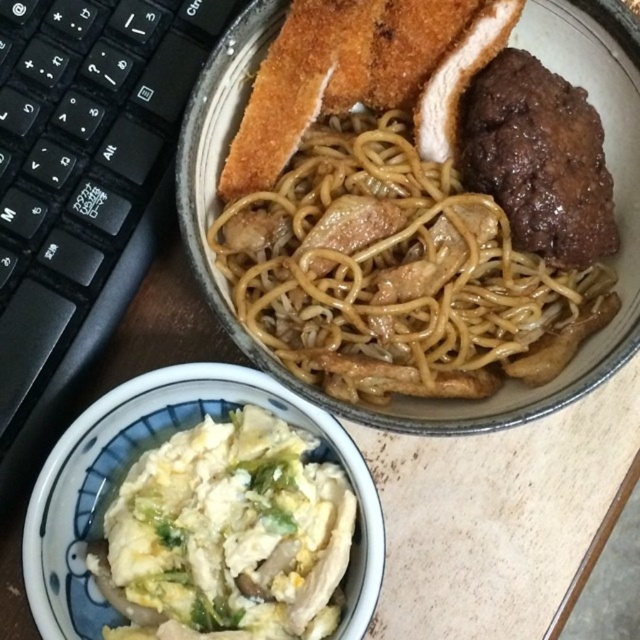
You are sitting at the table and want to reach both points on the table. Which point is closer to you, point (3,241) or point (497,173)?

Point (3,241) is closer to you because it is further to the viewer than point (497,173).

You are a graphic designer working on a project that requires precise measurements. You need to place a digital representation of the black plastic keyboard at upper left exactly at coordinates point 0.291, 0.127. Can you confirm if the current placement matches the required coordinates?

The position of black plastic keyboard at upper left is at point (x=81, y=186), so yes, the current placement matches the required coordinates.

From the picture: You are a chef preparing a meal and need to check the placement of the white fluffy scrambled eggs at lower left and the brown glossy meat at center. Based on their positions, which one is closer to the edge of the table?

The white fluffy scrambled eggs at lower left is closer to the edge of the table because it is positioned below the brown glossy meat at center, indicating it is lower on the table and thus nearer to the edge.